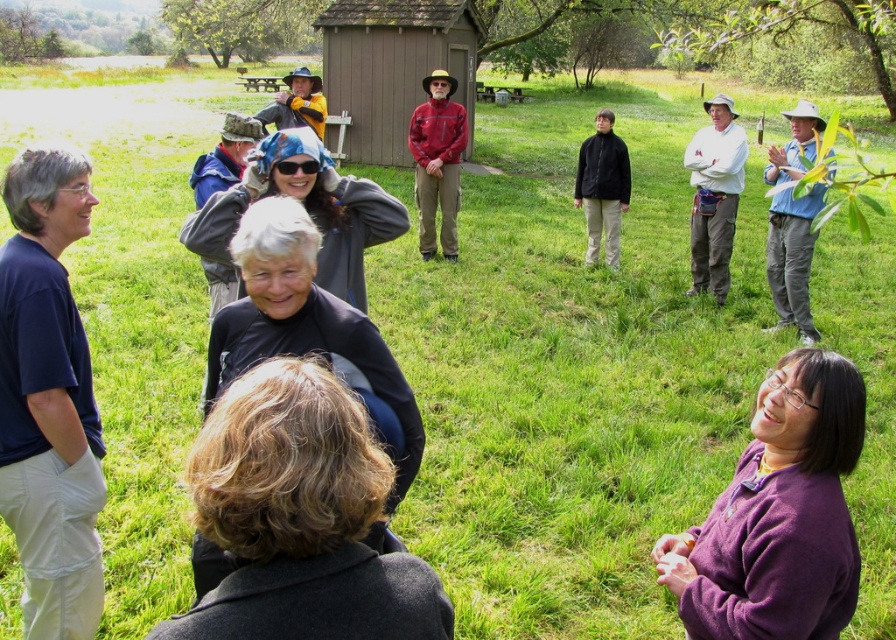
Locate an element on the screen. green leafy tree at upper right is located at coordinates (794, 28).

Is point (874, 4) in front of point (428, 200)?

No, it is behind (428, 200).

The width and height of the screenshot is (896, 640). I want to click on green leafy tree at upper right, so click(794, 28).

What do you see at coordinates (714, 195) in the screenshot? Image resolution: width=896 pixels, height=640 pixels. I see `white cotton shirt at right` at bounding box center [714, 195].

Between white cotton shirt at right and green leafy tree at upper left, which one appears on the left side from the viewer's perspective?

From the viewer's perspective, green leafy tree at upper left appears more on the left side.

This screenshot has width=896, height=640. In order to click on white cotton shirt at right in this screenshot , I will do `click(714, 195)`.

Who is more forward, (220, 490) or (458, 20)?

Point (220, 490) is more forward.

Does point (343, 605) lie in front of point (446, 1)?

That is True.

Where is `dark brown hair at lower center`? The height and width of the screenshot is (640, 896). dark brown hair at lower center is located at coordinates (300, 518).